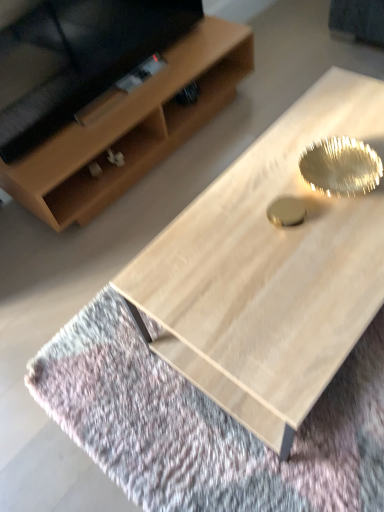
Question: Is light wood coffee table at center shorter than light brown wood shelf at upper left?

Choices:
 (A) no
 (B) yes

Answer: (A)

Question: Would you say light wood coffee table at center is outside light brown wood shelf at upper left?

Choices:
 (A) yes
 (B) no

Answer: (A)

Question: Considering the relative sizes of light wood coffee table at center and light brown wood shelf at upper left in the image provided, is light wood coffee table at center thinner than light brown wood shelf at upper left?

Choices:
 (A) yes
 (B) no

Answer: (B)

Question: Is light wood coffee table at center positioned with its back to light brown wood shelf at upper left?

Choices:
 (A) yes
 (B) no

Answer: (B)

Question: Does light wood coffee table at center have a smaller size compared to light brown wood shelf at upper left?

Choices:
 (A) no
 (B) yes

Answer: (A)

Question: Does light wood coffee table at center touch light brown wood shelf at upper left?

Choices:
 (A) yes
 (B) no

Answer: (B)

Question: From a real-world perspective, is light brown wood shelf at upper left on light wood coffee table at center?

Choices:
 (A) yes
 (B) no

Answer: (B)

Question: Is light brown wood shelf at upper left looking in the opposite direction of light wood coffee table at center?

Choices:
 (A) yes
 (B) no

Answer: (B)

Question: Is light wood coffee table at center located within light brown wood shelf at upper left?

Choices:
 (A) no
 (B) yes

Answer: (A)

Question: Is light brown wood shelf at upper left to the right of light wood coffee table at center from the viewer's perspective?

Choices:
 (A) no
 (B) yes

Answer: (A)

Question: Would you consider light brown wood shelf at upper left to be distant from light wood coffee table at center?

Choices:
 (A) yes
 (B) no

Answer: (B)

Question: Is light brown wood shelf at upper left wider than light wood coffee table at center?

Choices:
 (A) no
 (B) yes

Answer: (A)

Question: Is light brown wood shelf at upper left in front of or behind light wood coffee table at center in the image?

Choices:
 (A) behind
 (B) front

Answer: (A)